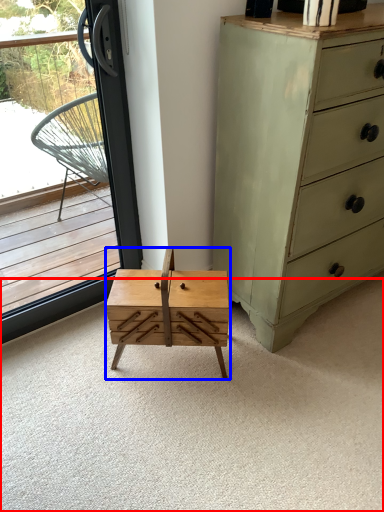
Question: Among these objects, which one is farthest to the camera, plain (highlighted by a red box) or table (highlighted by a blue box)?

Choices:
 (A) plain
 (B) table

Answer: (B)